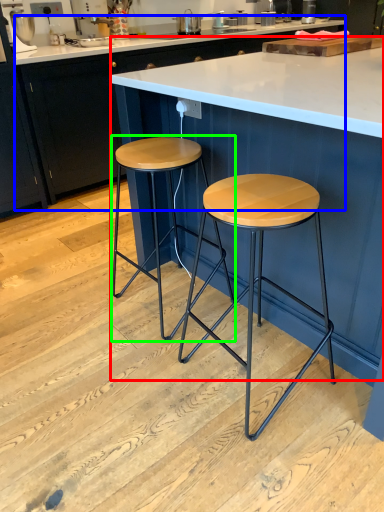
Question: Considering the real-world distances, which object is closest to table (highlighted by a red box)? cabinetry (highlighted by a blue box) or stool (highlighted by a green box).

Choices:
 (A) cabinetry
 (B) stool

Answer: (B)